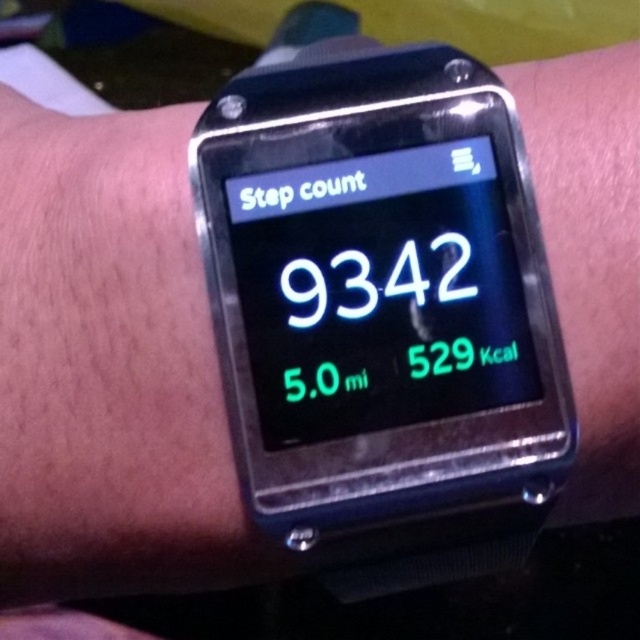
From the picture: You are looking at a wrist wearing a smartwatch. There are two watches mentioned here, a black plastic watch at center and a black matte watch at center. Which one is on the right side?

The black plastic watch at center is positioned on the right side of the black matte watch at center.

You are examining a smartwatch screen. There are two points on the screen at coordinates point (289, 349) and point (176, 516). Which point is nearer to you?

Point (289, 349) is closer to the camera than point (176, 516), so the point at (289, 349) is nearer to you.

You are trying to decide between two smartwatches displayed in a store. The first is the black plastic watch at center and the second is the black matte watch at center. The store has a shelf that can only hold items spaced at least 10 centimeters apart. Can both watches be placed on the shelf without violating the spacing requirement?

The distance between the black plastic watch at center and the black matte watch at center is 9.76 centimeters, which is less than the required 10 centimeters. Therefore, they cannot be placed on the shelf without violating the spacing requirement.